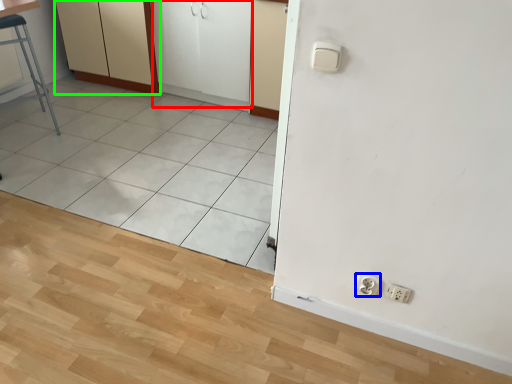
Question: Based on their relative distances, which object is farther from screen door (highlighted by a red box)? Choose from socket (highlighted by a blue box) and dresser (highlighted by a green box).

Choices:
 (A) socket
 (B) dresser

Answer: (A)